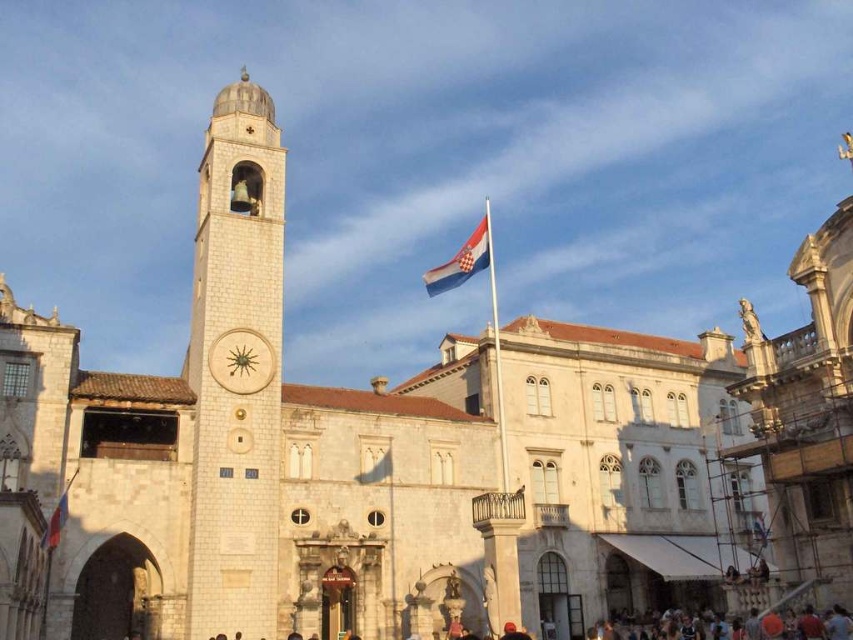
Between wooden clock at center and red fabric flag at lower left, which one appears on the left side from the viewer's perspective?

From the viewer's perspective, red fabric flag at lower left appears more on the left side.

Is wooden clock at center closer to camera compared to red fabric flag at lower left?

No.

Does point (241, 340) come behind point (67, 497)?

Yes, it is.

Image resolution: width=853 pixels, height=640 pixels. Identify the location of wooden clock at center. (241, 360).

Is wooden clock at center above blue and white striped flag at center?

No, wooden clock at center is not above blue and white striped flag at center.

Between point (212, 362) and point (471, 244), which one is positioned behind?

The point (471, 244) is behind.

The width and height of the screenshot is (853, 640). I want to click on wooden clock at center, so click(x=241, y=360).

Can you confirm if blue and white striped flag at center is thinner than red fabric flag at lower left?

No, blue and white striped flag at center is not thinner than red fabric flag at lower left.

Can you confirm if blue and white striped flag at center is positioned above red fabric flag at lower left?

Correct, blue and white striped flag at center is located above red fabric flag at lower left.

The width and height of the screenshot is (853, 640). In order to click on blue and white striped flag at center in this screenshot , I will do `click(461, 260)`.